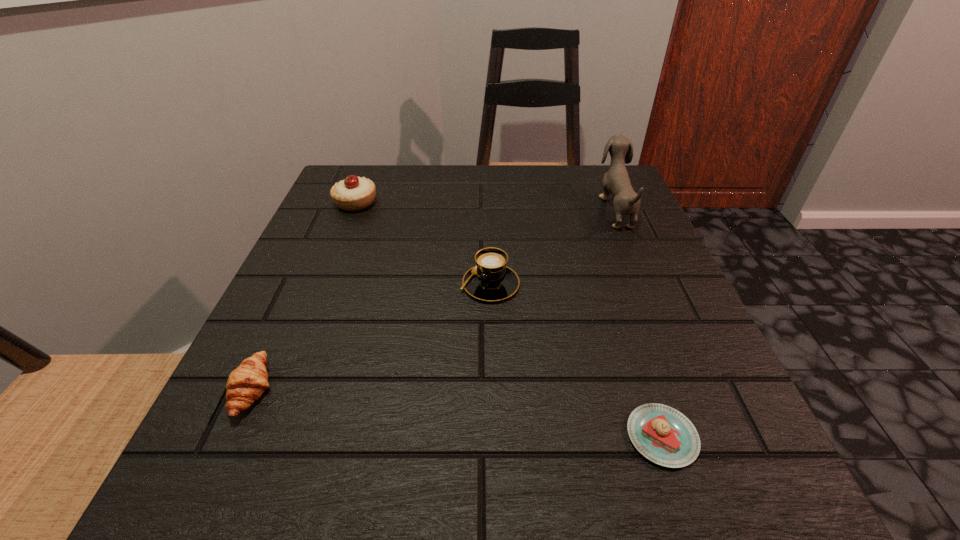
In order to click on vacant area that lies between the fourth tallest object and the farthest pastry in this screenshot , I will do `click(304, 296)`.

You are a GUI agent. You are given a task and a screenshot of the screen. Output one action in this format:
    pyautogui.click(x=<x>, y=<y>)
    Task: Click on the empty location between the puppy and the fourth tallest object
    
    Given the screenshot: What is the action you would take?
    pyautogui.click(x=434, y=299)

Locate an element on the screen. empty space that is in between the rightmost pastry and the puppy is located at coordinates (638, 322).

Find the location of a particular element. The width and height of the screenshot is (960, 540). free spot between the third object from left to right and the tallest pastry is located at coordinates (422, 244).

Identify the location of free space between the third tallest object and the rightmost pastry. Image resolution: width=960 pixels, height=540 pixels. (576, 361).

The image size is (960, 540). What are the coordinates of `vacant area between the third object from left to right and the second shortest pastry` in the screenshot? It's located at (372, 337).

The height and width of the screenshot is (540, 960). Identify the location of free area in between the shortest object and the cappuccino. (576, 361).

Locate an element on the screen. This screenshot has height=540, width=960. unoccupied position between the second shortest pastry and the fourth shortest object is located at coordinates (304, 296).

Identify the location of vacant space that is in between the cappuccino and the farthest pastry. (422, 244).

You are a GUI agent. You are given a task and a screenshot of the screen. Output one action in this format:
    pyautogui.click(x=<x>, y=<y>)
    Task: Click on the free area in between the second tallest pastry and the tallest object
    The width and height of the screenshot is (960, 540).
    Given the screenshot: What is the action you would take?
    pyautogui.click(x=434, y=299)